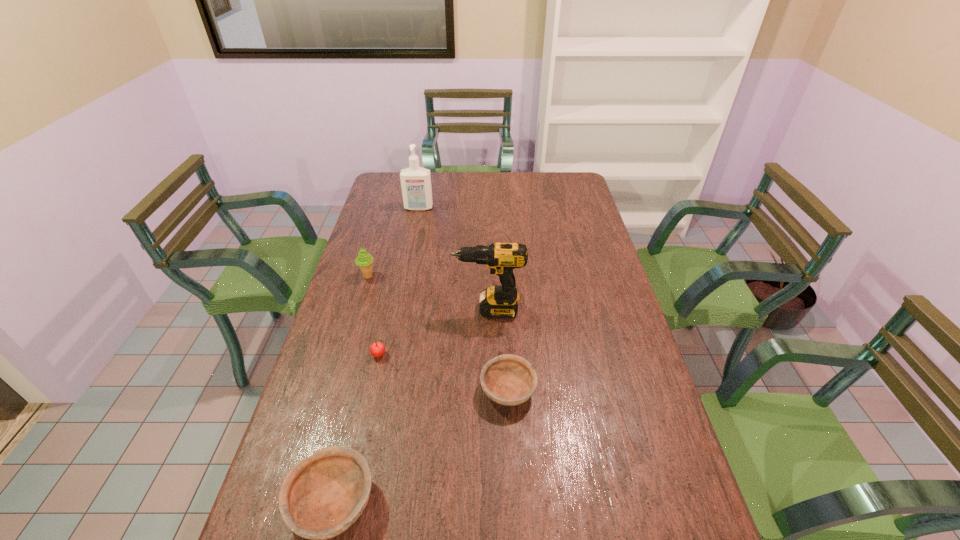
Locate an element on the screen. Image resolution: width=960 pixels, height=540 pixels. vacant space that satisfies the following two spatial constraints: 1. on the front label of the cleansing agent; 2. on the left side of the shorter bowl is located at coordinates (383, 390).

Find the location of a particular element. The height and width of the screenshot is (540, 960). free space that satisfies the following two spatial constraints: 1. at the tip of the fourth nearest object; 2. on the front side of the fourth farthest object is located at coordinates (490, 355).